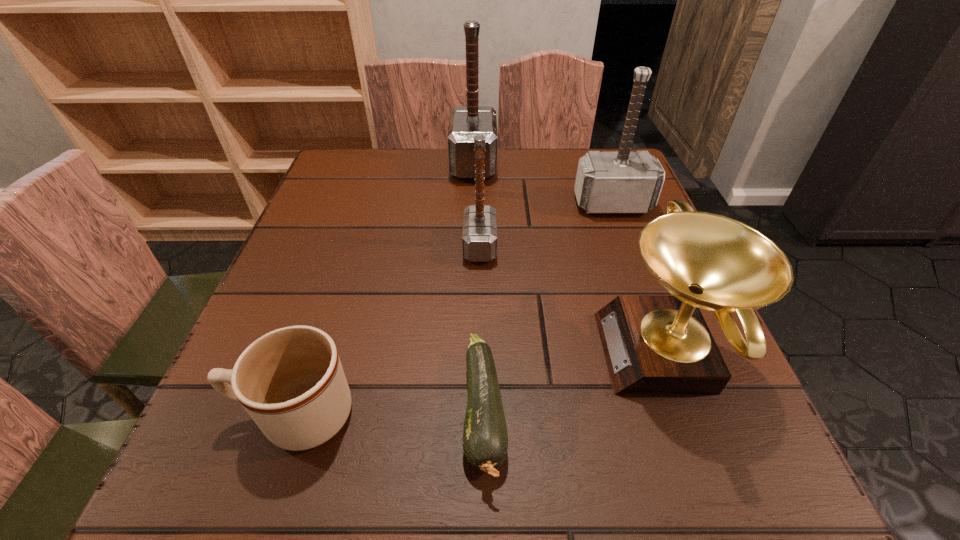
At what (x,y) coordinates should I click in order to perform the action: click on vacant space that is in between the zucchini and the farthest hammer. Please return your answer as a coordinate pair (x, y). Image resolution: width=960 pixels, height=540 pixels. Looking at the image, I should click on (479, 289).

You are a GUI agent. You are given a task and a screenshot of the screen. Output one action in this format:
    pyautogui.click(x=<x>, y=<y>)
    Task: Click on the empty location between the award and the shortest object
    This screenshot has width=960, height=540.
    Given the screenshot: What is the action you would take?
    click(x=574, y=383)

Where is `free space that is in between the shortest hammer and the second farthest object`? free space that is in between the shortest hammer and the second farthest object is located at coordinates (546, 225).

This screenshot has height=540, width=960. What are the coordinates of `free space between the farthest hammer and the award` in the screenshot? It's located at (569, 259).

At what (x,y) coordinates should I click in order to perform the action: click on vacant area that lies between the zucchini and the award. Please return your answer as a coordinate pair (x, y). The width and height of the screenshot is (960, 540). Looking at the image, I should click on [574, 383].

Point out which object is positioned as the nearest to the second nearest hammer. Please provide its 2D coordinates. Your answer should be formatted as a tuple, i.e. [(x, y)], where the tuple contains the x and y coordinates of a point satisfying the conditions above.

[(466, 122)]

You are a GUI agent. You are given a task and a screenshot of the screen. Output one action in this format:
    pyautogui.click(x=<x>, y=<y>)
    Task: Click on the object identified as the fifth closest to the shortest object
    The image size is (960, 540).
    Given the screenshot: What is the action you would take?
    pyautogui.click(x=466, y=122)

Select which hammer is the second closest to the shortest hammer. Please provide its 2D coordinates. Your answer should be formatted as a tuple, i.e. [(x, y)], where the tuple contains the x and y coordinates of a point satisfying the conditions above.

[(623, 182)]

Choose which hammer is the nearest neighbor to the farthest hammer. Please provide its 2D coordinates. Your answer should be formatted as a tuple, i.e. [(x, y)], where the tuple contains the x and y coordinates of a point satisfying the conditions above.

[(479, 234)]

The height and width of the screenshot is (540, 960). Identify the location of vacant space that satisfies the following two spatial constraints: 1. on the side of the fifth tallest object with the handle; 2. on the left side of the farthest object. (377, 165).